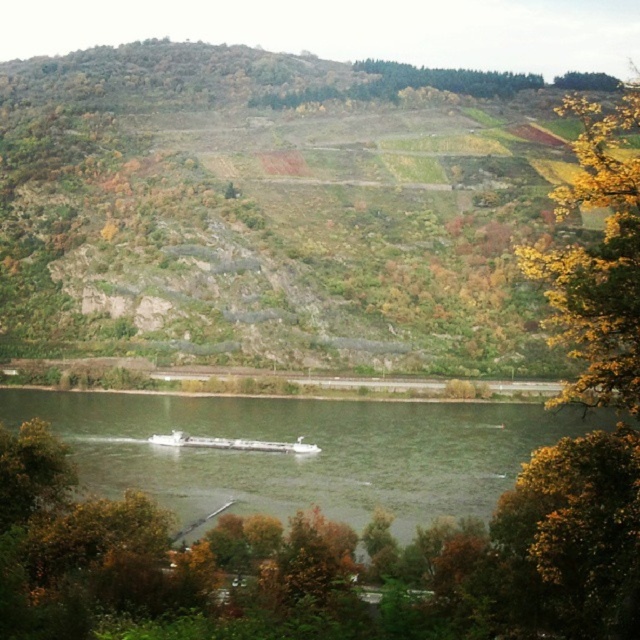
Question: Is green grassy hillside at center below white matte barge at lower center?

Choices:
 (A) no
 (B) yes

Answer: (A)

Question: Is yellow leafy tree at upper right behind white matte barge at lower center?

Choices:
 (A) yes
 (B) no

Answer: (B)

Question: Which of the following is the farthest from the observer?

Choices:
 (A) (253, 442)
 (B) (310, 113)
 (C) (586, 264)

Answer: (B)

Question: Is yellow leafy tree at upper right further to camera compared to white matte barge at lower center?

Choices:
 (A) yes
 (B) no

Answer: (B)

Question: Which point is closer to the camera?

Choices:
 (A) greenish-gray water at center
 (B) green grassy hillside at center

Answer: (A)

Question: Which object appears farthest from the camera in this image?

Choices:
 (A) green grassy hillside at center
 (B) white matte barge at lower center
 (C) yellow leafy tree at upper right

Answer: (A)